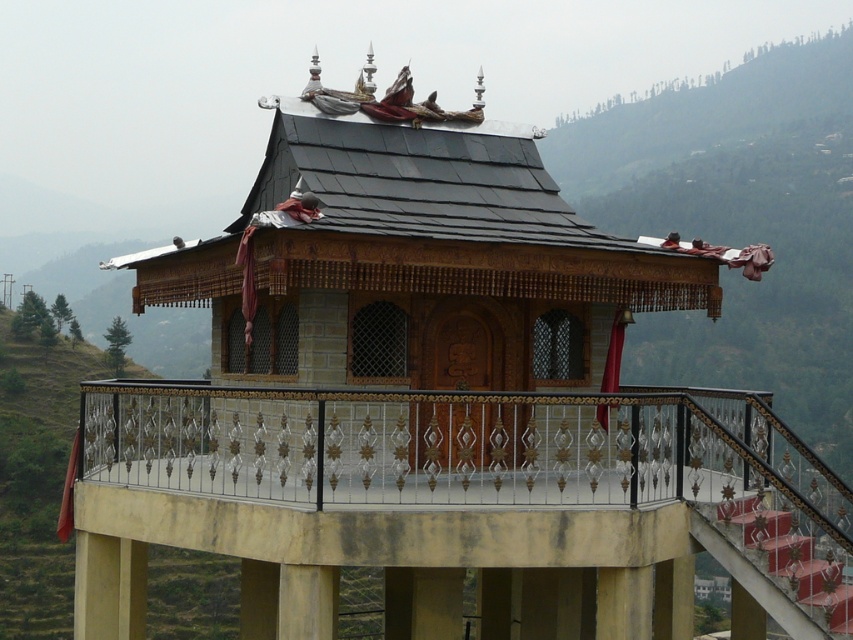
Question: Does metallic wrought iron balcony at center have a larger size compared to wooden gazebo at center?

Choices:
 (A) yes
 (B) no

Answer: (A)

Question: Among these objects, which one is farthest from the camera?

Choices:
 (A) metallic wrought iron balcony at center
 (B) wooden gazebo at center

Answer: (B)

Question: Can you confirm if metallic wrought iron balcony at center is positioned to the right of wooden gazebo at center?

Choices:
 (A) yes
 (B) no

Answer: (A)

Question: Which point is closer to the camera?

Choices:
 (A) (85, 506)
 (B) (613, 262)

Answer: (B)

Question: Which point appears closest to the camera in this image?

Choices:
 (A) (819, 595)
 (B) (276, 368)

Answer: (A)

Question: Can you confirm if metallic wrought iron balcony at center is wider than wooden gazebo at center?

Choices:
 (A) no
 (B) yes

Answer: (B)